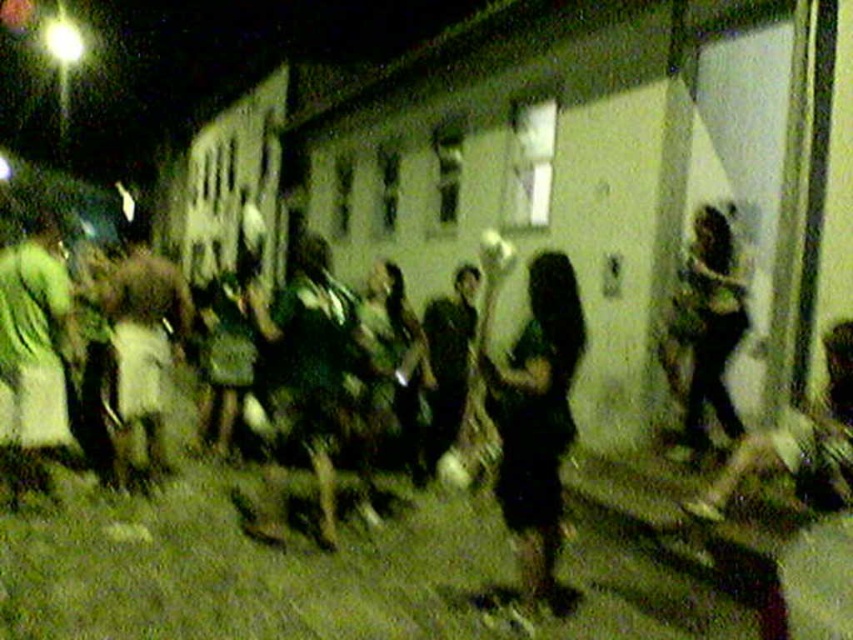
You are a security guard patrolling at night and see the dark matte figure at center and the dark green fabric shirt at center in the scene. Based on their positions, which one is closer to the left side of the image?

The dark green fabric shirt at center is closer to the left side of the image because the dark matte figure at center is to the right of it.

What does the point at coordinates [537,420] in the image represent?

The point at coordinates [537,420] corresponds to the dark matte figure at center.

You are a security guard observing a nighttime scene with a strong light source on the left. You notice two figures at the center of the image. One is labeled as the dark matte figure at center, and the other is the dark green fabric shirt at center. Based on the lighting and their positions, which figure is closer to the light source?

The dark matte figure at center is closer to the light source because it is positioned in front of the dark green fabric shirt at center, and the light source is on the left side, casting shadows away from it. Since the dark matte figure is in front, it is likely closer to the light.